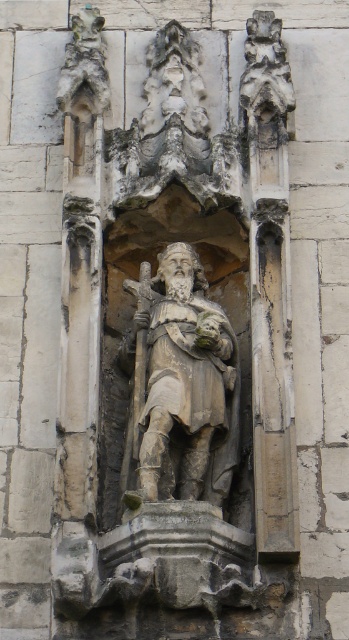
Does stone statue at center appear on the right side of carved stone ornament at upper center?

Incorrect, stone statue at center is not on the right side of carved stone ornament at upper center.

From the picture: Can you confirm if stone statue at center is taller than carved stone ornament at upper center?

Yes.

Is point (211, 497) in front of point (243, 77)?

That is True.

At what (x,y) coordinates should I click in order to perform the action: click on stone statue at center. Please return your answer as a coordinate pair (x, y). Looking at the image, I should click on (181, 387).